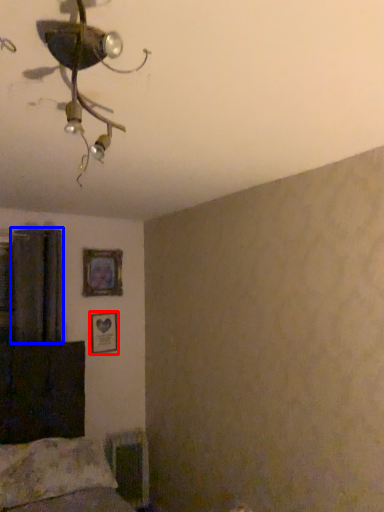
Question: Which object is further to the camera taking this photo, picture frame (highlighted by a red box) or curtain (highlighted by a blue box)?

Choices:
 (A) picture frame
 (B) curtain

Answer: (A)